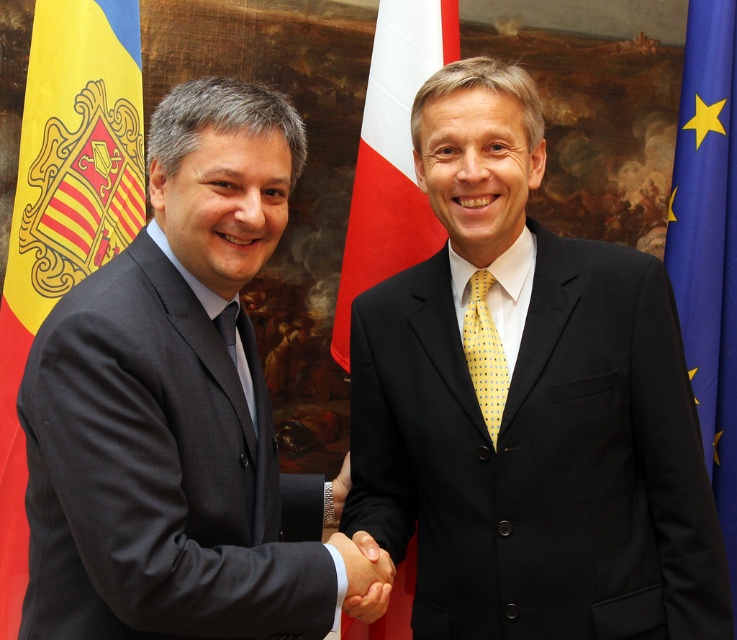
Is black matte suit at center bigger than yellow dotted tie at center?

Indeed, black matte suit at center has a larger size compared to yellow dotted tie at center.

Who is more forward, (663, 445) or (495, 390)?

Point (663, 445)

Find the location of a particular element. This screenshot has height=640, width=737. black matte suit at center is located at coordinates (528, 406).

Does yellow dotted tie at center have a smaller size compared to smooth skin hand at center?

Correct, yellow dotted tie at center occupies less space than smooth skin hand at center.

Is yellow dotted tie at center taller than smooth skin hand at center?

Correct, yellow dotted tie at center is much taller as smooth skin hand at center.

Who is more distant from viewer, (469, 291) or (380, 580)?

Point (469, 291)

Where is `yellow dotted tie at center`? yellow dotted tie at center is located at coordinates coord(483,353).

Who is more forward, (x=733, y=588) or (x=447, y=61)?

Point (x=447, y=61)

Identify the location of blue fabric flag at right. This screenshot has width=737, height=640. (708, 243).

Where is `blue fabric flag at right`? This screenshot has width=737, height=640. blue fabric flag at right is located at coordinates pos(708,243).